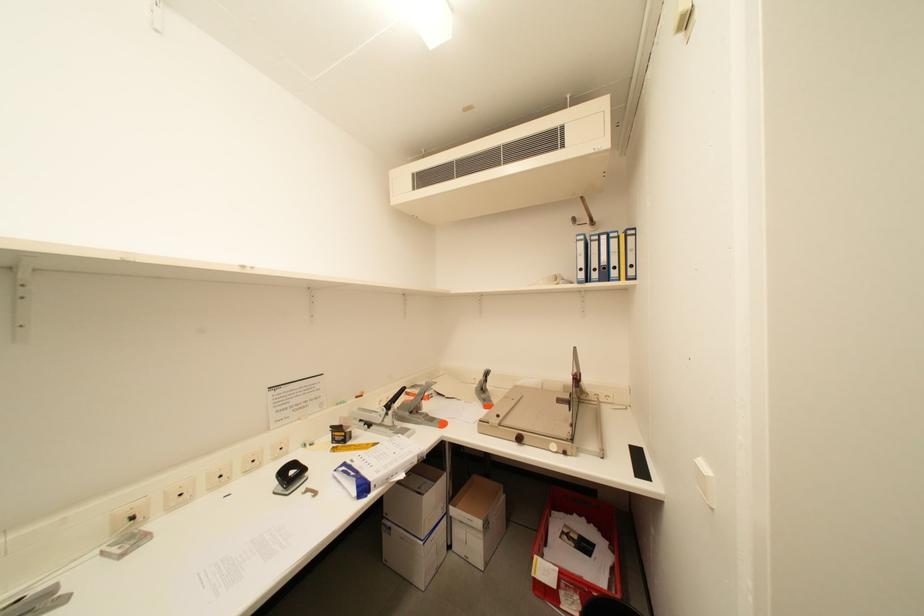
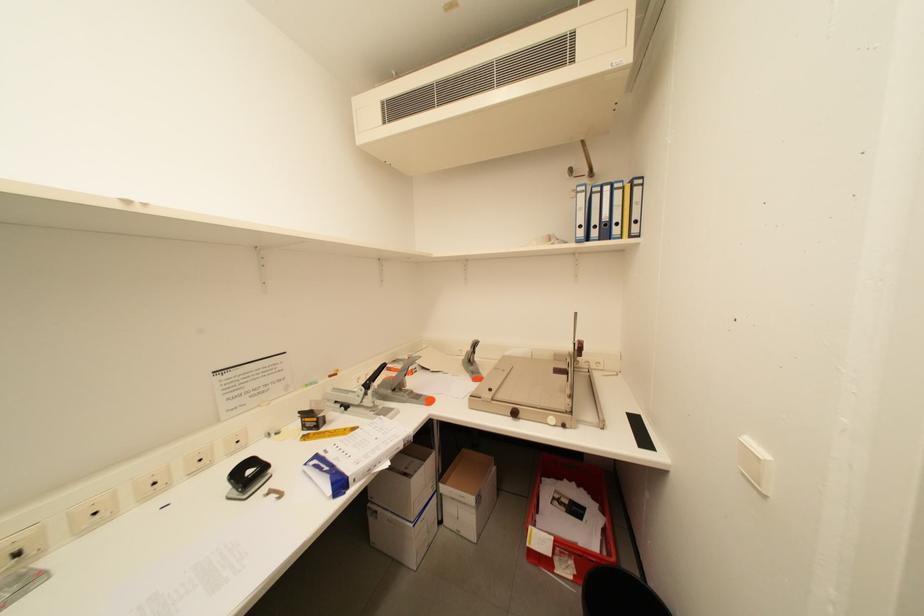
Question: What movement of the cameraman would produce the second image?

Choices:
 (A) Left
 (B) Right
 (C) Forward
 (D) Backward

Answer: (C)